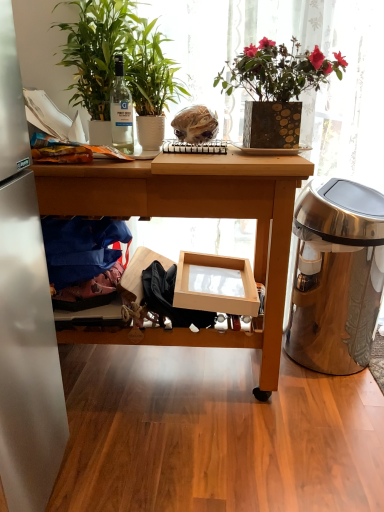
Locate an element on the screen. The width and height of the screenshot is (384, 512). vacant space underneath stainless steel trash can at right (from a real-world perspective) is located at coordinates (324, 370).